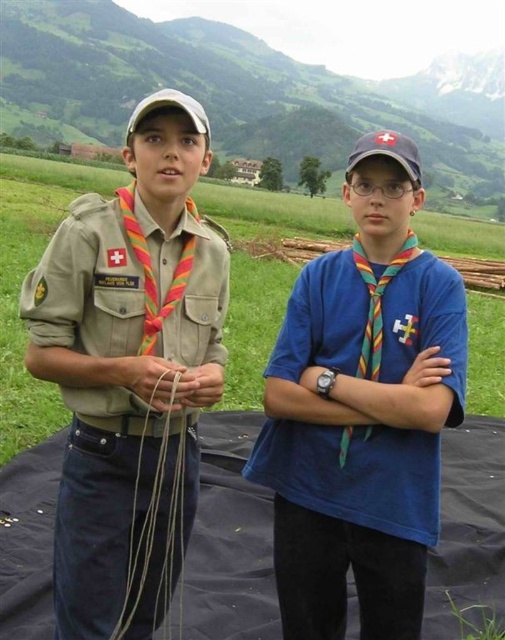
Question: Which of the following is the farthest from the observer?

Choices:
 (A) blue matte shirt at center
 (B) black fabric blanket at lower center
 (C) natural tan string at lower left
 (D) tan uniform at left

Answer: (B)

Question: Is blue matte shirt at center smaller than natural tan string at lower left?

Choices:
 (A) no
 (B) yes

Answer: (A)

Question: Is blue matte shirt at center to the left of black fabric blanket at lower center from the viewer's perspective?

Choices:
 (A) no
 (B) yes

Answer: (B)

Question: From the image, what is the correct spatial relationship of blue matte shirt at center in relation to black fabric blanket at lower center?

Choices:
 (A) left
 (B) right

Answer: (A)

Question: Estimate the real-world distances between objects in this image. Which object is farther from the tan uniform at left?

Choices:
 (A) blue matte shirt at center
 (B) black fabric blanket at lower center
 (C) natural tan string at lower left

Answer: (B)

Question: Which point is farther from the camera taking this photo?

Choices:
 (A) (74, 234)
 (B) (227, 563)
 (C) (155, 628)

Answer: (B)